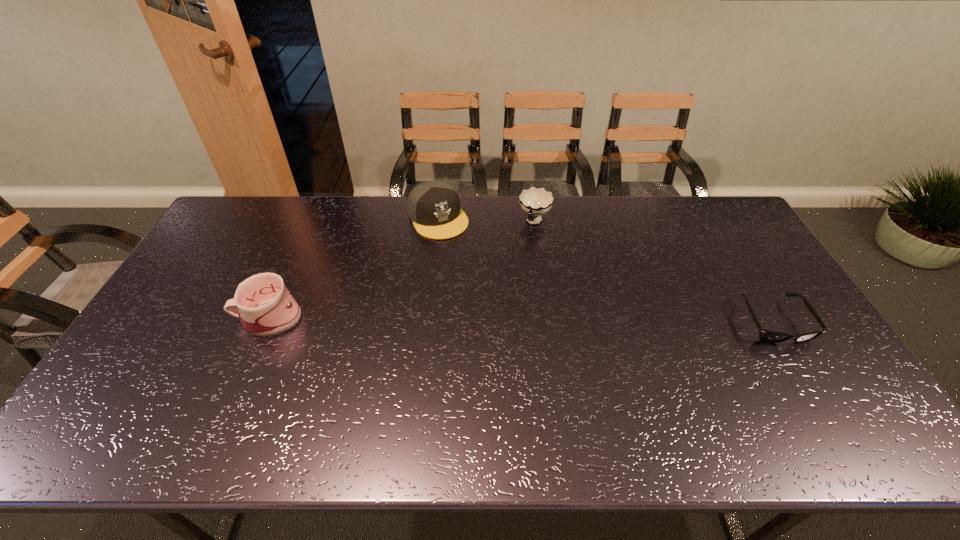
At what (x,y) coordinates should I click in order to perform the action: click on free spot on the desktop that is between the leftmost object and the shortest object and is positioned on the side of the cup with the handle. Please return your answer as a coordinate pair (x, y). Looking at the image, I should click on (495, 320).

At what (x,y) coordinates should I click in order to perform the action: click on free space on the desktop that is between the mug and the sunglasses and is positioned on the front-facing side of the cap. Please return your answer as a coordinate pair (x, y). Looking at the image, I should click on (505, 320).